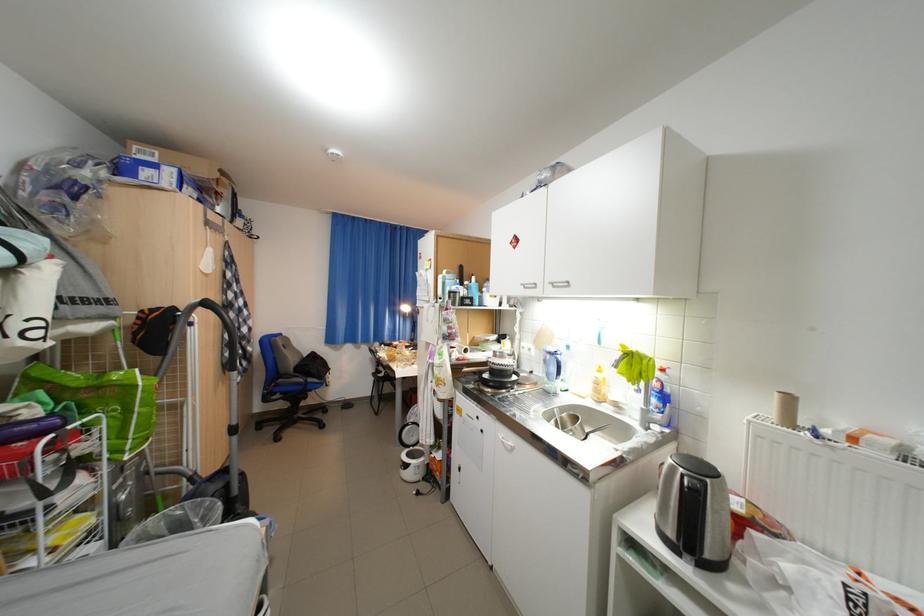
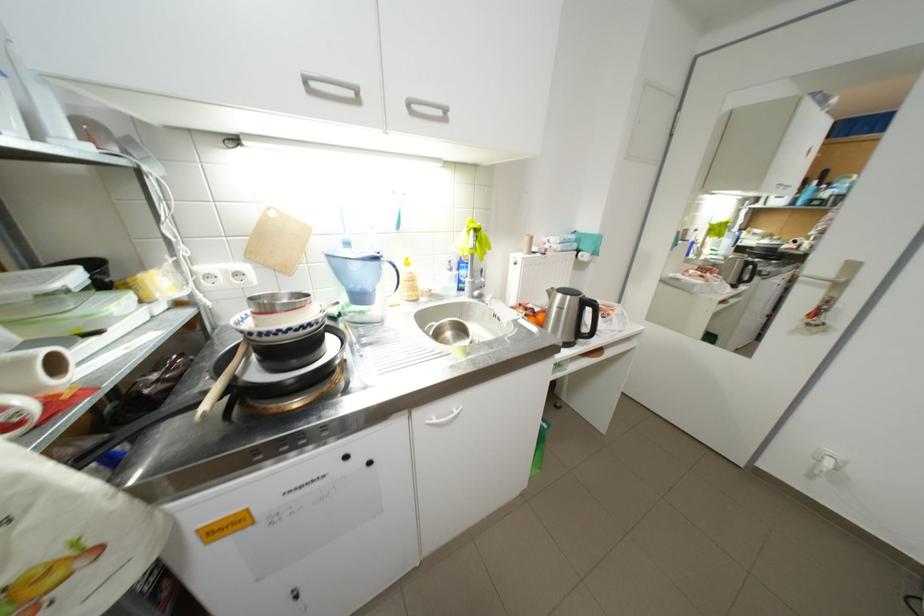
Question: I am providing you with two images of the same scene from different viewpoints. After the viewpoint changes to image2, which objects are now occluded?

Choices:
 (A) wooden spoon handle
 (B) small metal bowl
 (C) silver cabinet handle
 (D) none of these

Answer: (D)